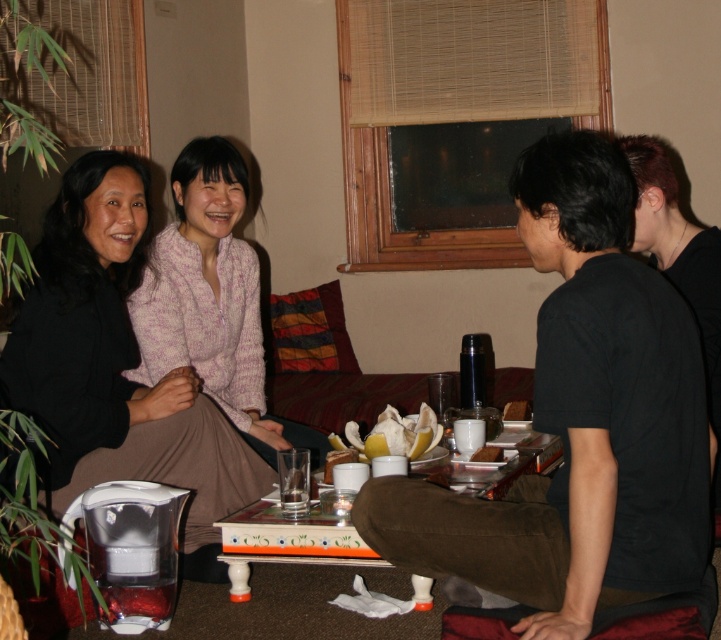
Looking at this image, how far apart are knitted sweater at center and wooden painted table at center?

They are 51.89 centimeters apart.

Between knitted sweater at center and wooden painted table at center, which one is positioned lower?

wooden painted table at center is below.

What do you see at coordinates (115, 365) in the screenshot? I see `knitted sweater at center` at bounding box center [115, 365].

Locate an element on the screen. knitted sweater at center is located at coordinates (115, 365).

Does black matte shirt at right come in front of clear glass at center?

Yes.

From the picture: Which of these two, black matte shirt at right or clear glass at center, stands shorter?

clear glass at center is shorter.

Is point (642, 237) positioned behind point (283, 499)?

No, (642, 237) is closer to viewer.

Where is `black matte shirt at right`? This screenshot has height=640, width=721. black matte shirt at right is located at coordinates (681, 262).

Who is shorter, black matte shirt at right or wooden painted table at center?

wooden painted table at center

Consider the image. Is black matte shirt at right below wooden painted table at center?

No.

Is point (650, 168) positioned in front of point (265, 502)?

That is True.

Where is `black matte shirt at right`? Image resolution: width=721 pixels, height=640 pixels. black matte shirt at right is located at coordinates (681, 262).